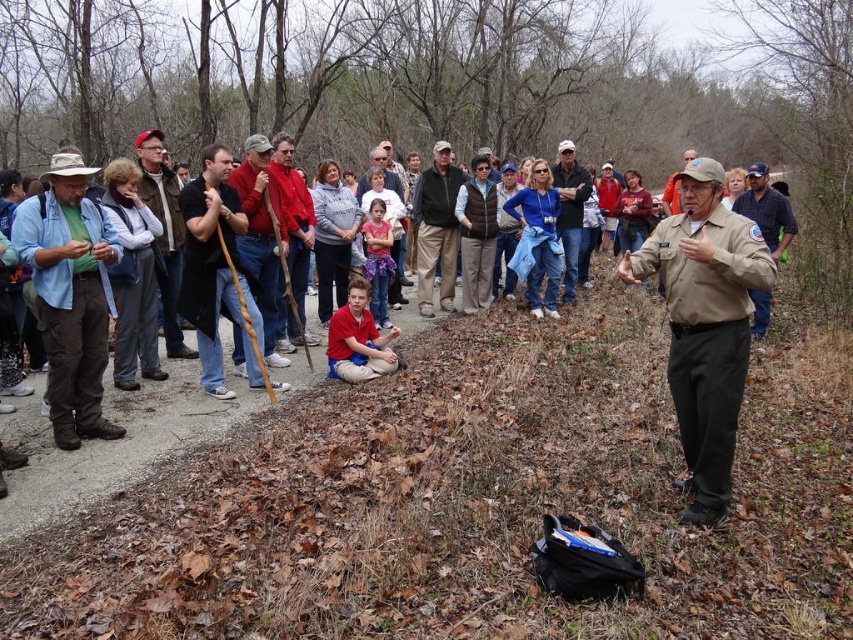
Can you confirm if light blue denim shirt at left is positioned to the right of brown uniform at center?

No, light blue denim shirt at left is not to the right of brown uniform at center.

Between light blue denim shirt at left and brown uniform at center, which one is positioned higher?

Positioned higher is brown uniform at center.

Where is `light blue denim shirt at left`? light blue denim shirt at left is located at coordinates (70, 296).

Based on the photo, which is above, red shirt at center or brown uniform at center?

brown uniform at center

The height and width of the screenshot is (640, 853). Identify the location of red shirt at center. (358, 339).

This screenshot has width=853, height=640. Find the location of `red shirt at center`. red shirt at center is located at coordinates (358, 339).

Locate an element on the screen. The image size is (853, 640). red shirt at center is located at coordinates (358, 339).

Between point (53, 388) and point (183, 348), which one is positioned in front?

Point (53, 388) is in front.

The height and width of the screenshot is (640, 853). What do you see at coordinates (70, 296) in the screenshot?
I see `light blue denim shirt at left` at bounding box center [70, 296].

Between point (90, 300) and point (163, 152), which one is positioned behind?

The point (163, 152) is behind.

You are a GUI agent. You are given a task and a screenshot of the screen. Output one action in this format:
    pyautogui.click(x=<x>, y=<y>)
    Task: Click on the light blue denim shirt at left
    The width and height of the screenshot is (853, 640).
    Given the screenshot: What is the action you would take?
    pyautogui.click(x=70, y=296)